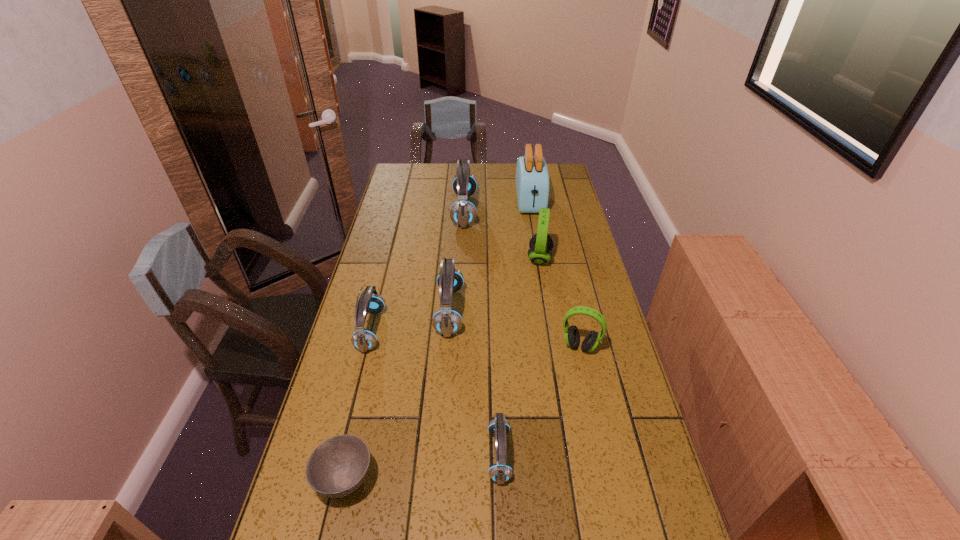
At what (x,y) coordinates should I click in order to perform the action: click on the nearest blue headset. Please return your answer as a coordinate pair (x, y). The height and width of the screenshot is (540, 960). Looking at the image, I should click on (499, 427).

This screenshot has height=540, width=960. I want to click on the second shortest object, so click(x=499, y=427).

Find the location of a particular element. bowl is located at coordinates (338, 466).

This screenshot has height=540, width=960. In order to click on vacant space situated on the side of the toaster with the lever in this screenshot , I will do [540, 261].

The height and width of the screenshot is (540, 960). I want to click on vacant space located on the ear cups of the farthest headset, so [x=489, y=210].

The image size is (960, 540). I want to click on vacant space located on the front of the third farthest object, so click(549, 318).

What are the coordinates of `vacant point located 0.230m on the ear cups of the second biggest blue headset` in the screenshot? It's located at (534, 311).

Locate an element on the screen. vacant space situated 0.110m on the back of the smaller green headset is located at coordinates (572, 310).

Locate an element on the screen. Image resolution: width=960 pixels, height=540 pixels. vacant space located 0.190m on the ear cups of the third biggest blue headset is located at coordinates (444, 329).

This screenshot has height=540, width=960. What are the coordinates of `vacant space located 0.110m on the ear cups of the seventh tallest object` in the screenshot? It's located at (443, 455).